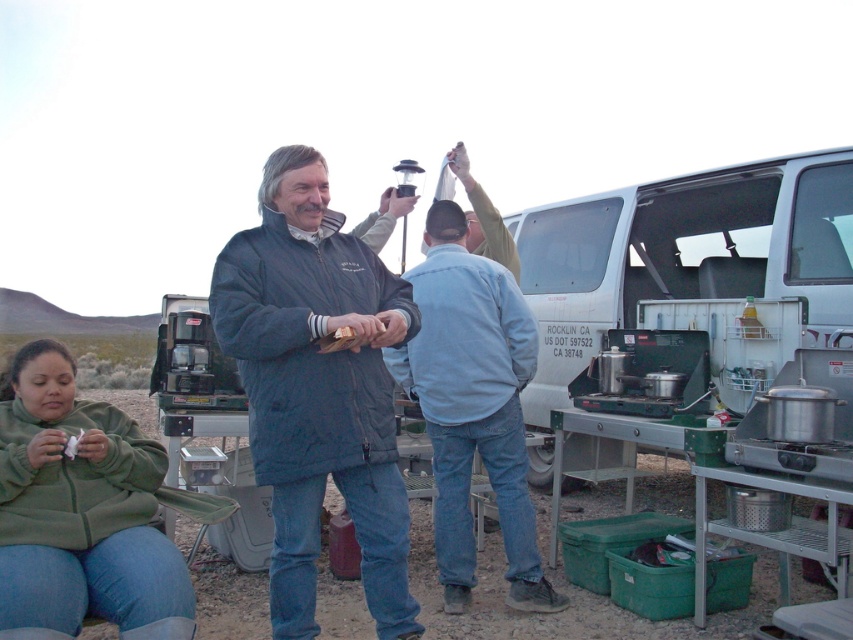
Identify the location of white plastic van at center. The width and height of the screenshot is (853, 640). (692, 269).

Consider the image. Which of these two, blue quilted jacket at center or green fleece jacket at lower left, stands shorter?

green fleece jacket at lower left is shorter.

Where is `blue quilted jacket at center`? The image size is (853, 640). blue quilted jacket at center is located at coordinates (317, 388).

What do you see at coordinates (692, 269) in the screenshot?
I see `white plastic van at center` at bounding box center [692, 269].

Is point (538, 394) more distant than point (294, 346)?

Yes, it is.

Who is more forward, (526,228) or (280,618)?

Point (280,618) is in front.

Where is `white plastic van at center`? The height and width of the screenshot is (640, 853). white plastic van at center is located at coordinates (692, 269).